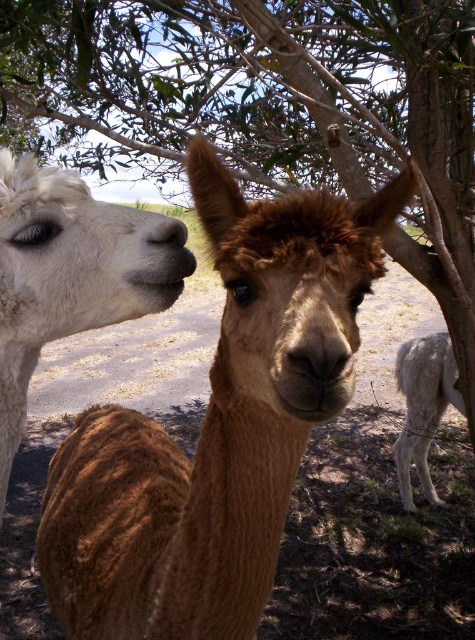
Question: Does white woolly alpaca at left appear under matte black nose at center?

Choices:
 (A) no
 (B) yes

Answer: (B)

Question: Is brown fuzzy alpaca at center positioned behind matte black nose at center?

Choices:
 (A) yes
 (B) no

Answer: (B)

Question: Does brown fuzzy alpaca at center have a larger size compared to white woolly alpaca at left?

Choices:
 (A) yes
 (B) no

Answer: (A)

Question: Which object is closer to the camera taking this photo?

Choices:
 (A) white woolen camel at lower right
 (B) white woolly alpaca at left
 (C) matte black nose at center

Answer: (B)

Question: Which object is positioned farthest from the brown fuzzy alpaca at center?

Choices:
 (A) white woolen camel at lower right
 (B) matte black nose at center
 (C) white woolly alpaca at left

Answer: (A)

Question: Which point is farther to the camera?

Choices:
 (A) (159, 221)
 (B) (116, 230)
 (C) (206, 492)

Answer: (C)